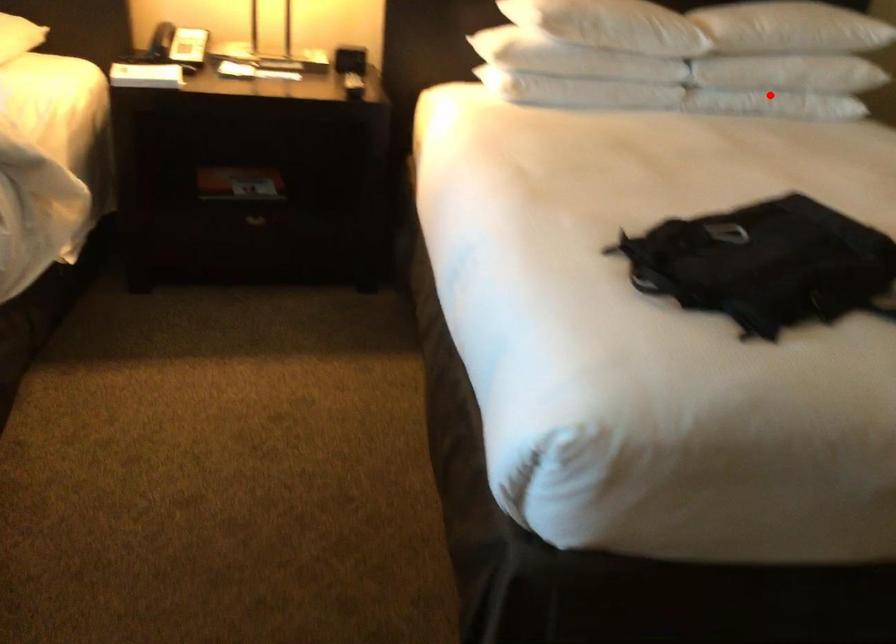
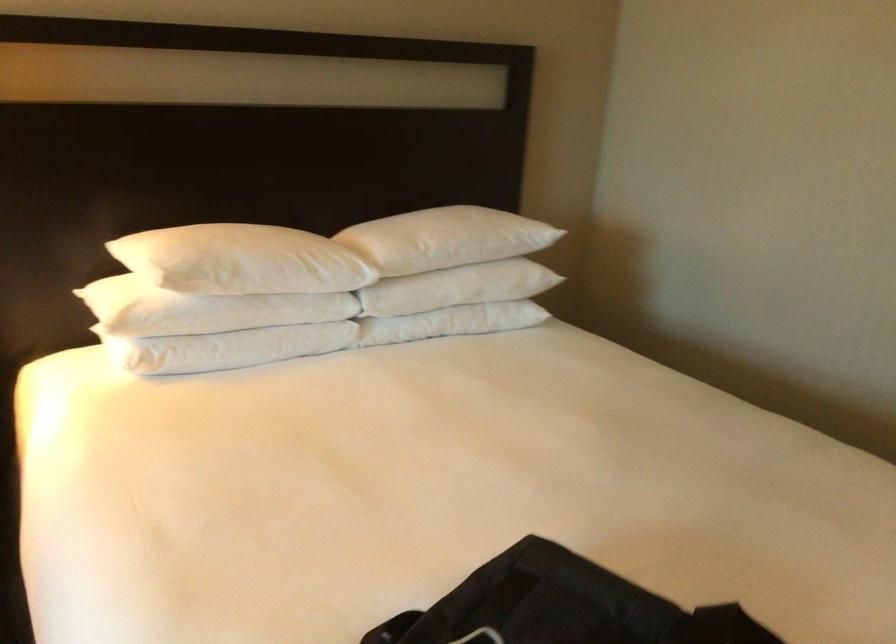
In the second image, find the point that corresponds to the highlighted location in the first image.

(451, 322)